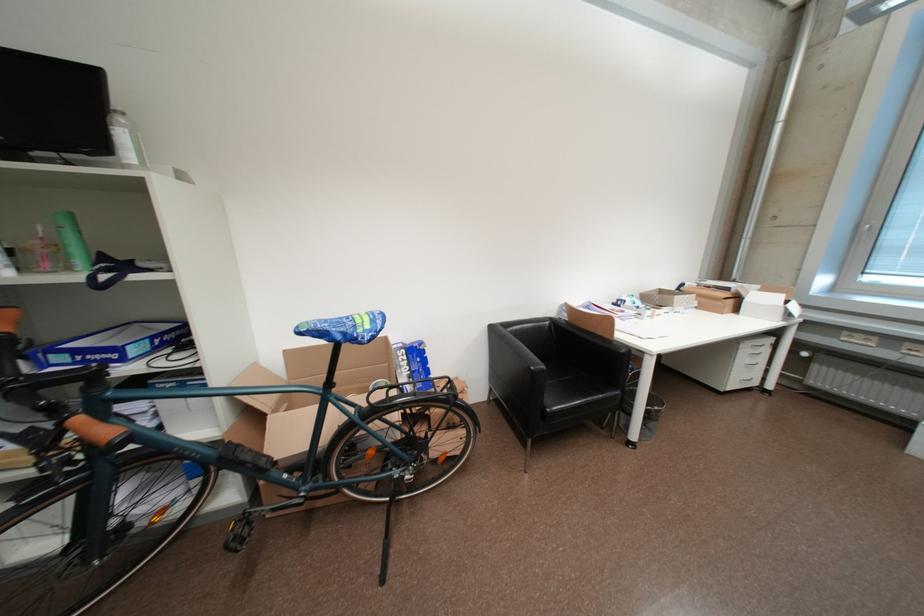
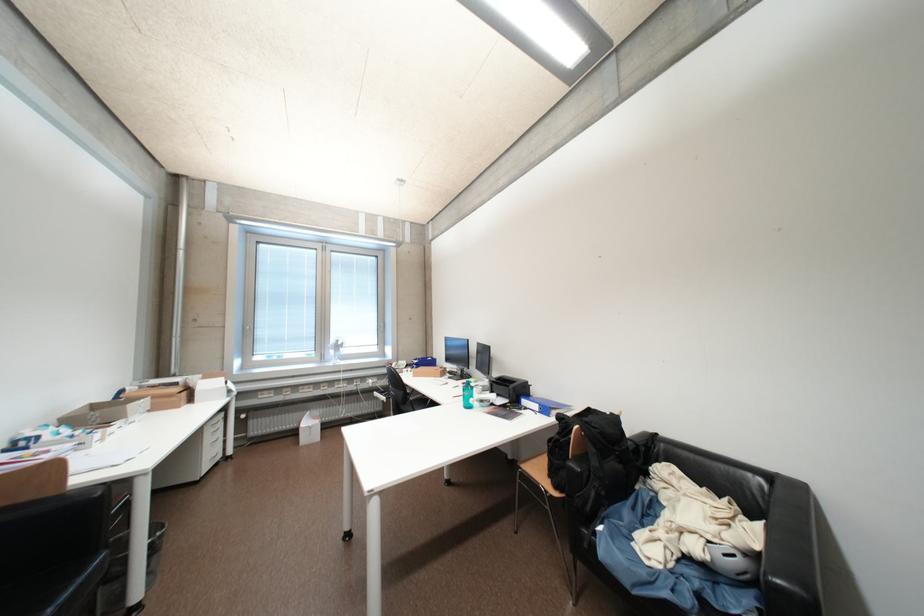
Where in the second image is the point corresponding to (754,352) from the first image?

(216, 432)